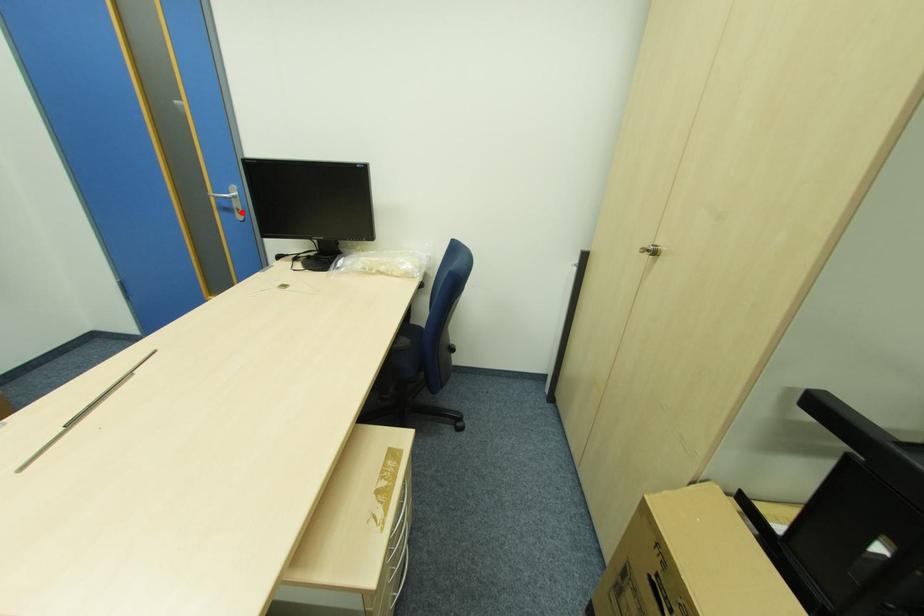
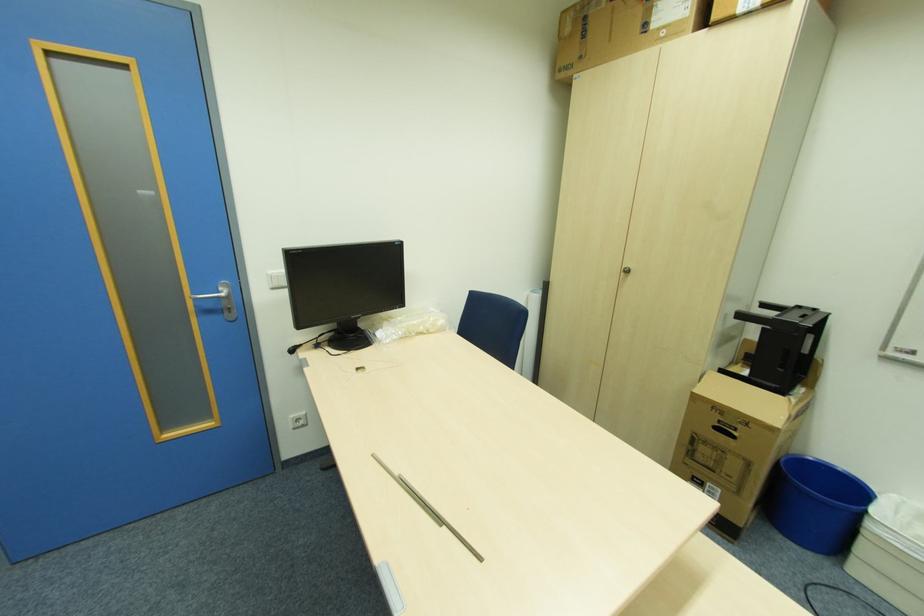
The point at the highlighted location is marked in the first image. Where is the corresponding point in the second image?

(234, 310)